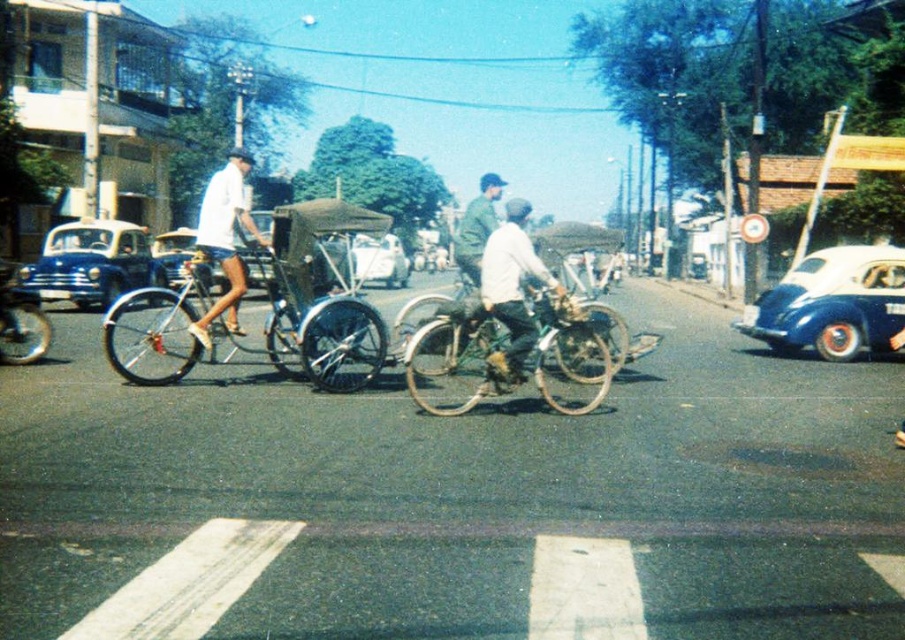
Question: Which of the following is the farthest from the observer?

Choices:
 (A) (582, 326)
 (B) (208, 246)
 (C) (319, 234)

Answer: (C)

Question: Is white matte shirt at center to the left of white glossy car at center from the viewer's perspective?

Choices:
 (A) yes
 (B) no

Answer: (B)

Question: Which point is farther to the camera?

Choices:
 (A) (501, 296)
 (B) (201, 337)
 (C) (853, 316)
 (D) (72, 264)

Answer: (D)

Question: Is matte black rickshaw at center thinner than white glossy car at center?

Choices:
 (A) no
 (B) yes

Answer: (A)

Question: Does matte black rickshaw at center lie behind white glossy car at center?

Choices:
 (A) no
 (B) yes

Answer: (A)

Question: Which object appears closest to the camera in this image?

Choices:
 (A) gold metallic bicycle at center
 (B) white matte shorts at center
 (C) blue matte car at right
 (D) white glossy car at center

Answer: (A)